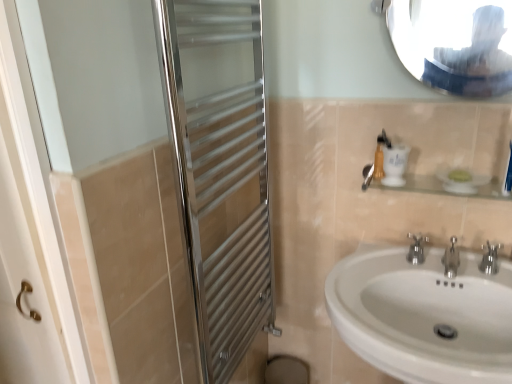
Question: Can we say polished chrome towel rack at left lies outside silver metallic tap at center, arranged as the 2th tap when viewed from the left?

Choices:
 (A) yes
 (B) no

Answer: (A)

Question: Is polished chrome towel rack at left to the right of silver metallic tap at center, arranged as the second tap when viewed from the right, from the viewer's perspective?

Choices:
 (A) no
 (B) yes

Answer: (A)

Question: Is polished chrome towel rack at left positioned behind silver metallic tap at center, arranged as the second tap when viewed from the right?

Choices:
 (A) no
 (B) yes

Answer: (A)

Question: Is silver metallic tap at center, arranged as the 2th tap when viewed from the left, completely or partially inside polished chrome towel rack at left?

Choices:
 (A) no
 (B) yes

Answer: (A)

Question: Is polished chrome towel rack at left wider than silver metallic tap at center, arranged as the 2th tap when viewed from the left?

Choices:
 (A) yes
 (B) no

Answer: (B)

Question: From the image's perspective, is polished chrome towel rack at left over silver metallic tap at center, arranged as the second tap when viewed from the right?

Choices:
 (A) no
 (B) yes

Answer: (B)

Question: Considering the relative sizes of polished metallic faucet at lower right, which is counted as the third tap, starting from the left, and clear glass shelf at upper right in the image provided, is polished metallic faucet at lower right, which is counted as the third tap, starting from the left, wider than clear glass shelf at upper right?

Choices:
 (A) yes
 (B) no

Answer: (B)

Question: Is polished metallic faucet at lower right, which is counted as the third tap, starting from the left, oriented towards clear glass shelf at upper right?

Choices:
 (A) yes
 (B) no

Answer: (B)

Question: Can you see polished metallic faucet at lower right, which is counted as the 1th tap, starting from the right, touching clear glass shelf at upper right?

Choices:
 (A) yes
 (B) no

Answer: (B)

Question: Is polished metallic faucet at lower right, which is counted as the third tap, starting from the left, behind clear glass shelf at upper right?

Choices:
 (A) no
 (B) yes

Answer: (B)

Question: Is polished metallic faucet at lower right, which is counted as the 1th tap, starting from the right, facing away from clear glass shelf at upper right?

Choices:
 (A) yes
 (B) no

Answer: (B)

Question: Considering the relative sizes of polished metallic faucet at lower right, which is counted as the third tap, starting from the left, and clear glass shelf at upper right in the image provided, is polished metallic faucet at lower right, which is counted as the third tap, starting from the left, bigger than clear glass shelf at upper right?

Choices:
 (A) no
 (B) yes

Answer: (A)

Question: Does polished metallic faucet at lower right, which is counted as the third tap, starting from the left, come in front of glossy metallic mirror at upper center?

Choices:
 (A) yes
 (B) no

Answer: (B)